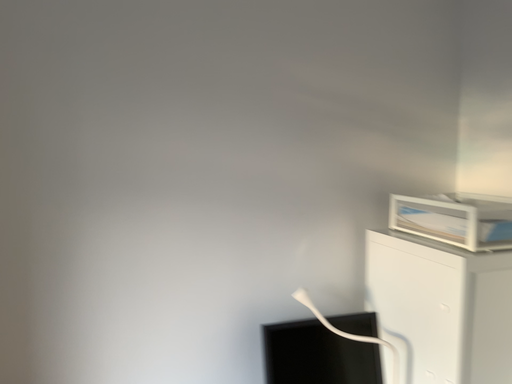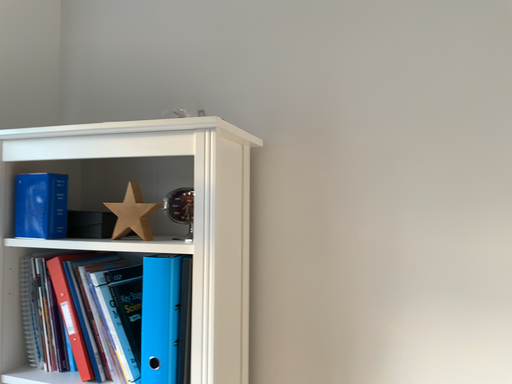
Question: Which way did the camera rotate in the video?

Choices:
 (A) rotated upward
 (B) rotated downward

Answer: (A)